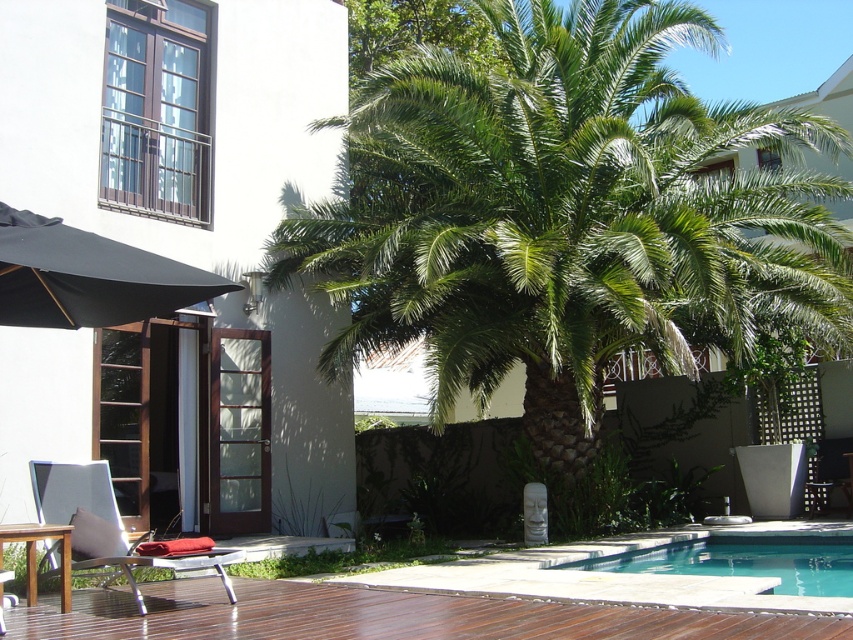
You are standing at the edge of the swimming pool and want to locate two points marked in the image. The first point is at coordinates point (x=772, y=540) and the second is at point (x=238, y=557). Which of these points is closer to you?

Point (x=772, y=540) is further to the viewer than point (x=238, y=557), so the closer point to you is point (x=238, y=557).

You are standing outside the villa and want to take a photo of the green leafy palm tree at center. If your camera has a maximum focus range of 10 meters, will it be able to capture the tree clearly?

The green leafy palm tree at center is 9.72 meters away from the viewer, which is within the camera maximum focus range of 10 meters. Therefore, the camera can capture the tree clearly.

You are planning to place a new bench in the garden. The bench is the same size as the metallic silver chair at lower left. Based on the current layout, will the bench fit in the space where the green leafy palm tree at center is located?

The green leafy palm tree at center occupies less space than the metallic silver chair at lower left. Since the bench is the same size as the metallic silver chair at lower left, the space currently occupied by the green leafy palm tree at center is smaller and may not accommodate the bench. Therefore, the bench might not fit there.